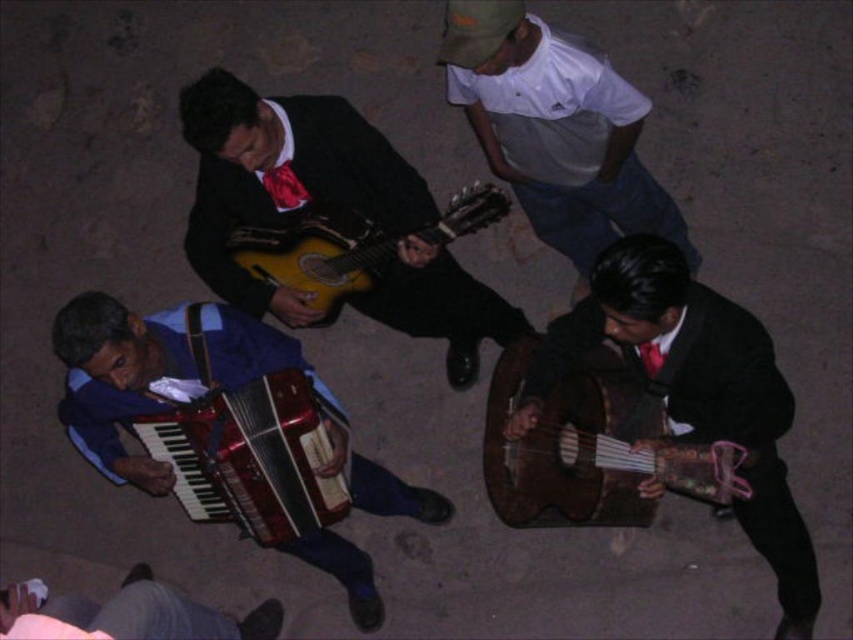
You are a photographer trying to capture the shiny brown guitar at right and the white cotton shirt at upper center in a single frame. Since the guitar is taller than the shirt, which object might require you to adjust your camera angle to include its full height?

The shiny brown guitar at right has a greater height compared to the white cotton shirt at upper center, so you would need to adjust your camera angle to include the full height of the shiny brown guitar at right.

You are a photographer setting up for a night shoot at the outdoor music performance. You need to ensure that both the wooden acoustic guitar at lower right and the matte red tie at upper center are visible in your frame. Given their sizes, which object should you focus on first to ensure proper framing?

The wooden acoustic guitar at lower right should be focused on first because it has a larger size compared to the matte red tie at upper center, making it more prominent in the frame.